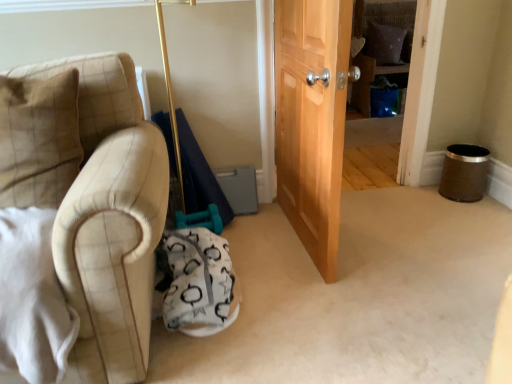
Question: Is brown fabric pillow at upper center, which ranks as the second pillow in left-to-right order, not inside white fabric swivel chair at lower center?

Choices:
 (A) no
 (B) yes

Answer: (B)

Question: Can you confirm if brown fabric pillow at upper center, which is counted as the first pillow, starting from the back, is thinner than white fabric swivel chair at lower center?

Choices:
 (A) no
 (B) yes

Answer: (B)

Question: Can you confirm if brown fabric pillow at upper center, placed as the first pillow when sorted from right to left, is smaller than white fabric swivel chair at lower center?

Choices:
 (A) no
 (B) yes

Answer: (B)

Question: Would you say brown fabric pillow at upper center, which is counted as the 2th pillow, starting from the front, contains white fabric swivel chair at lower center?

Choices:
 (A) no
 (B) yes

Answer: (A)

Question: From the image's perspective, is brown fabric pillow at upper center, which ranks as the second pillow in left-to-right order, located beneath white fabric swivel chair at lower center?

Choices:
 (A) yes
 (B) no

Answer: (B)

Question: Does point (377, 61) appear closer or farther from the camera than point (53, 192)?

Choices:
 (A) farther
 (B) closer

Answer: (A)

Question: Is brown fabric pillow at upper center, which ranks as the second pillow in left-to-right order, taller or shorter than beige plaid pillow at left, the 2th pillow when ordered from back to front?

Choices:
 (A) tall
 (B) short

Answer: (B)

Question: From a real-world perspective, is brown fabric pillow at upper center, the second pillow from the bottom, above or below beige plaid pillow at left, the first pillow viewed from the front?

Choices:
 (A) below
 (B) above

Answer: (A)

Question: Looking at their shapes, would you say brown fabric pillow at upper center, the first pillow positioned from the top, is wider or thinner than beige plaid pillow at left, arranged as the second pillow when viewed from the right?

Choices:
 (A) thin
 (B) wide

Answer: (A)

Question: Considering the positions of beige plaid pillow at left, the 2th pillow when ordered from back to front, and white fabric swivel chair at lower center in the image, is beige plaid pillow at left, the 2th pillow when ordered from back to front, bigger or smaller than white fabric swivel chair at lower center?

Choices:
 (A) small
 (B) big

Answer: (A)

Question: In terms of width, does beige plaid pillow at left, placed as the second pillow when sorted from top to bottom, look wider or thinner when compared to white fabric swivel chair at lower center?

Choices:
 (A) wide
 (B) thin

Answer: (B)

Question: Is beige plaid pillow at left, placed as the second pillow when sorted from top to bottom, situated inside white fabric swivel chair at lower center or outside?

Choices:
 (A) inside
 (B) outside

Answer: (B)

Question: In the image, is beige plaid pillow at left, which is counted as the 1th pillow, starting from the bottom, positioned in front of or behind white fabric swivel chair at lower center?

Choices:
 (A) behind
 (B) front

Answer: (B)

Question: Is brown fabric pillow at upper center, which ranks as the second pillow in left-to-right order, in front of or behind white fabric swivel chair at lower center in the image?

Choices:
 (A) front
 (B) behind

Answer: (B)

Question: In terms of height, does brown fabric pillow at upper center, which ranks as the second pillow in left-to-right order, look taller or shorter compared to white fabric swivel chair at lower center?

Choices:
 (A) short
 (B) tall

Answer: (B)